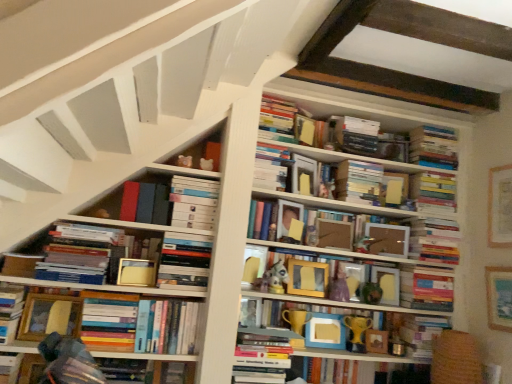
Question: From the image's perspective, is hardcover book at upper center, which ranks as the 16th book in bottom-to-top order, on hardcover books at lower left, the 11th book when ordered from top to bottom?

Choices:
 (A) yes
 (B) no

Answer: (A)

Question: Can you confirm if hardcover book at upper center, the 1th book from the top, is positioned to the left of hardcover books at lower left, which is the 6th book in bottom-to-top order?

Choices:
 (A) yes
 (B) no

Answer: (B)

Question: Can you confirm if hardcover book at upper center, the 1th book from the top, is wider than hardcover books at lower left, which is the 6th book in bottom-to-top order?

Choices:
 (A) yes
 (B) no

Answer: (B)

Question: Can you confirm if hardcover book at upper center, the 1th book from the top, is taller than hardcover books at lower left, which is the 6th book in bottom-to-top order?

Choices:
 (A) yes
 (B) no

Answer: (A)

Question: Can we say hardcover book at upper center, which ranks as the 16th book in bottom-to-top order, lies outside hardcover books at lower left, which is the 6th book in bottom-to-top order?

Choices:
 (A) no
 (B) yes

Answer: (B)

Question: Is hardcover book at upper center, which ranks as the 16th book in bottom-to-top order, to the right of hardcover books at lower left, which is the 6th book in bottom-to-top order, from the viewer's perspective?

Choices:
 (A) yes
 (B) no

Answer: (A)

Question: Considering the relative sizes of hardcover book at upper center, the 4th paperback book viewed from the front, and white matte bookshelf at center, acting as the 14th book starting from the bottom, in the image provided, is hardcover book at upper center, the 4th paperback book viewed from the front, thinner than white matte bookshelf at center, acting as the 14th book starting from the bottom,?

Choices:
 (A) yes
 (B) no

Answer: (A)

Question: Is white matte bookshelf at center, the 3th book viewed from the top, a part of hardcover book at upper center, arranged as the second paperback book when viewed from the back?

Choices:
 (A) no
 (B) yes

Answer: (A)

Question: Is the position of hardcover book at upper center, arranged as the second paperback book when viewed from the back, more distant than that of white matte bookshelf at center, acting as the 14th book starting from the bottom?

Choices:
 (A) no
 (B) yes

Answer: (B)

Question: Can you confirm if hardcover book at upper center, the first paperback book viewed from the right, is shorter than white matte bookshelf at center, the 3th book viewed from the top?

Choices:
 (A) no
 (B) yes

Answer: (A)

Question: From the image's perspective, is hardcover book at upper center, the 4th paperback book viewed from the front, beneath white matte bookshelf at center, acting as the 14th book starting from the bottom?

Choices:
 (A) yes
 (B) no

Answer: (A)

Question: From a real-world perspective, is hardcover book at upper center, the 4th paperback book viewed from the front, located beneath white matte bookshelf at center, acting as the 14th book starting from the bottom?

Choices:
 (A) yes
 (B) no

Answer: (A)

Question: From the image's perspective, is hardcover books at upper right, acting as the thirteenth book starting from the bottom, on top of wooden frame at center, the eighth book from the bottom?

Choices:
 (A) no
 (B) yes

Answer: (B)